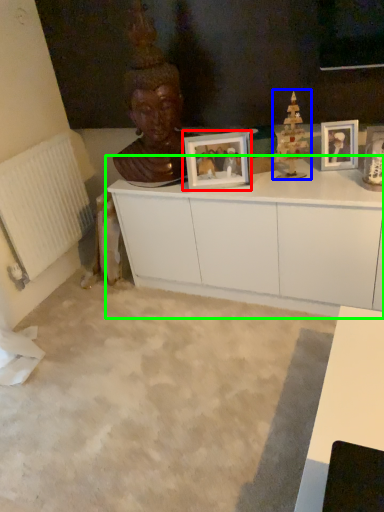
Question: Which object is the farthest from picture frame (highlighted by a red box)? Choose among these: toy (highlighted by a blue box) or cabinetry (highlighted by a green box).

Choices:
 (A) toy
 (B) cabinetry

Answer: (B)